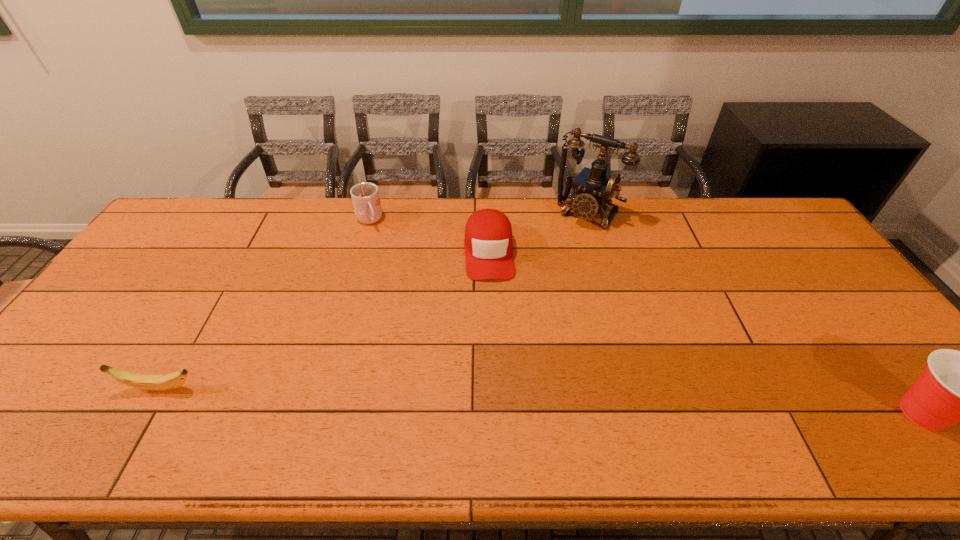
I want to click on vacant space on the desktop that is between the banana and the nearer cup and is positioned on the front-facing side of the baseball cap, so click(498, 399).

I want to click on free space on the desktop that is between the leftmost object and the rightmost object and is positioned on the rotary dial of the telephone, so click(457, 398).

Locate an element on the screen. The height and width of the screenshot is (540, 960). vacant space on the desktop that is between the banana and the nearer cup and is positioned on the side with the handle of the farther cup is located at coordinates (466, 398).